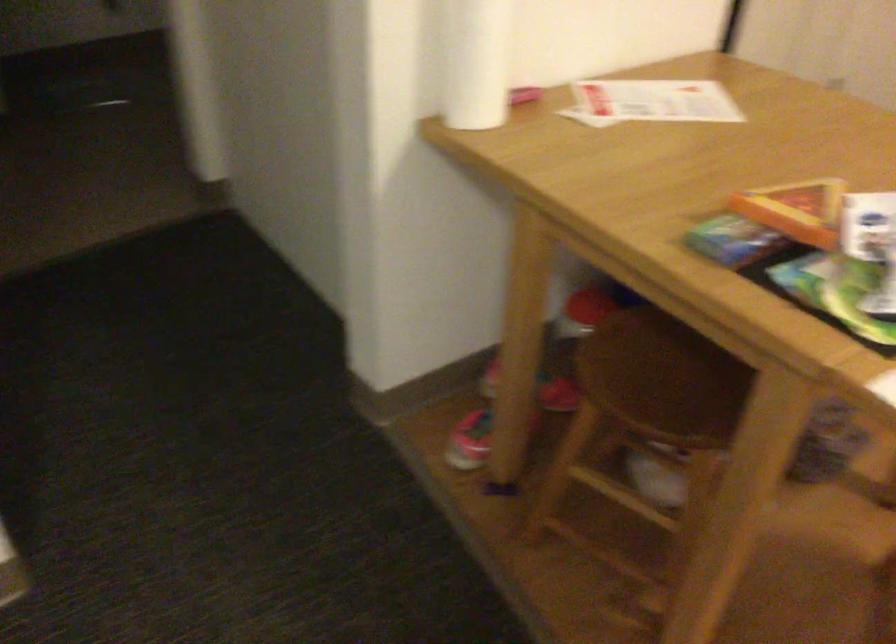
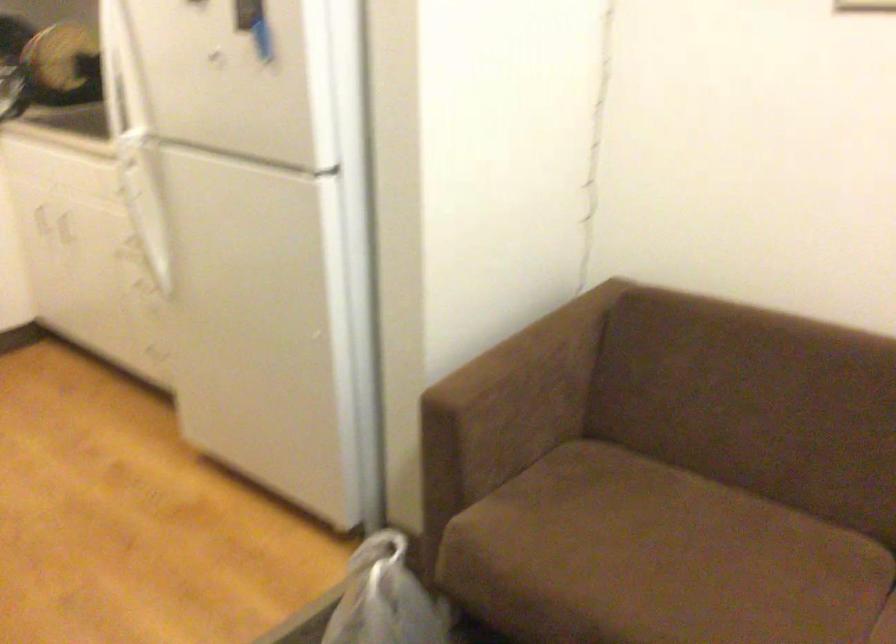
The first image is from the beginning of the video and the second image is from the end. How did the camera likely rotate when shooting the video?

The camera's rotation is toward right-down.